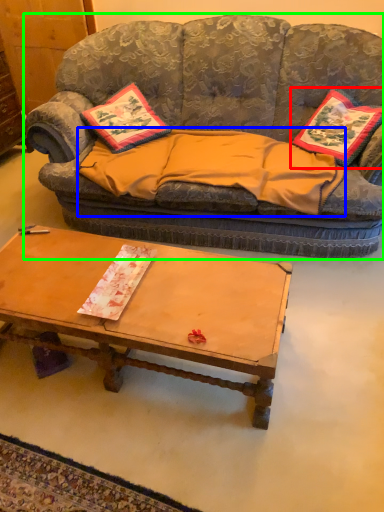
Question: Which object is the closest to the pillow (highlighted by a red box)? Choose among these: blanket (highlighted by a blue box) or studio couch (highlighted by a green box).

Choices:
 (A) blanket
 (B) studio couch

Answer: (A)